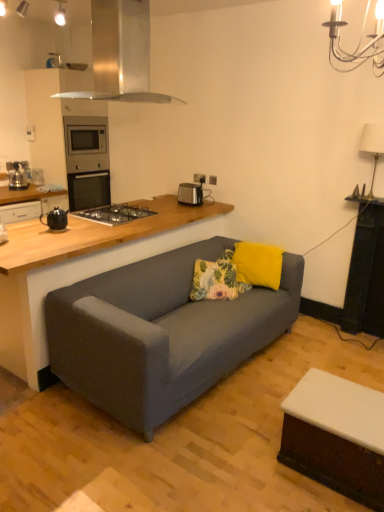
The image size is (384, 512). I want to click on free space in front of black plastic toaster at upper center, arranged as the first appliance when viewed from the back, so click(199, 206).